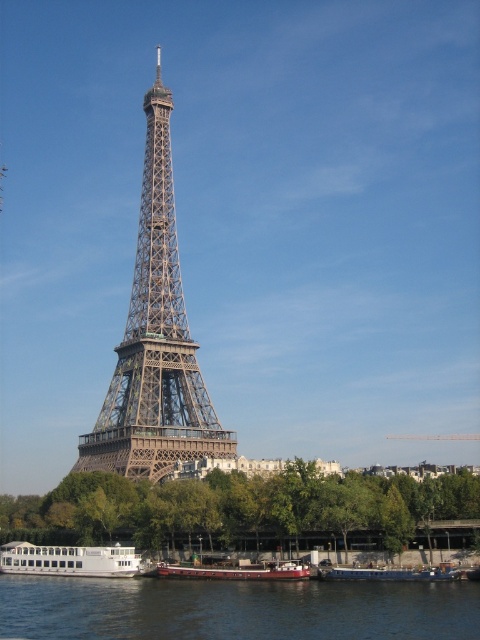
In the scene shown: Is green leafy tree at lower center closer to the viewer compared to white matte boat at lower left?

Yes, green leafy tree at lower center is closer to the viewer.

What are the coordinates of `green leafy tree at lower center` in the screenshot? It's located at (245, 512).

Image resolution: width=480 pixels, height=640 pixels. I want to click on green leafy tree at lower center, so click(245, 512).

Can you confirm if metallic structure at center is smaller than red matte barge at lower center?

Incorrect, metallic structure at center is not smaller in size than red matte barge at lower center.

Does metallic structure at center have a greater width compared to red matte barge at lower center?

Yes.

Where is `metallic structure at center`? This screenshot has width=480, height=640. metallic structure at center is located at coordinates (155, 340).

You are a GUI agent. You are given a task and a screenshot of the screen. Output one action in this format:
    pyautogui.click(x=<x>, y=<y>)
    Task: Click on the metallic structure at center
    The width and height of the screenshot is (480, 640).
    Given the screenshot: What is the action you would take?
    pyautogui.click(x=155, y=340)

Can you confirm if metallic structure at center is taller than white matte boat at lower left?

Yes.

Who is lower down, metallic structure at center or white matte boat at lower left?

white matte boat at lower left is lower down.

Identify the location of metallic structure at center. Image resolution: width=480 pixels, height=640 pixels. point(155,340).

The image size is (480, 640). Identify the location of metallic structure at center. pyautogui.click(x=155, y=340).